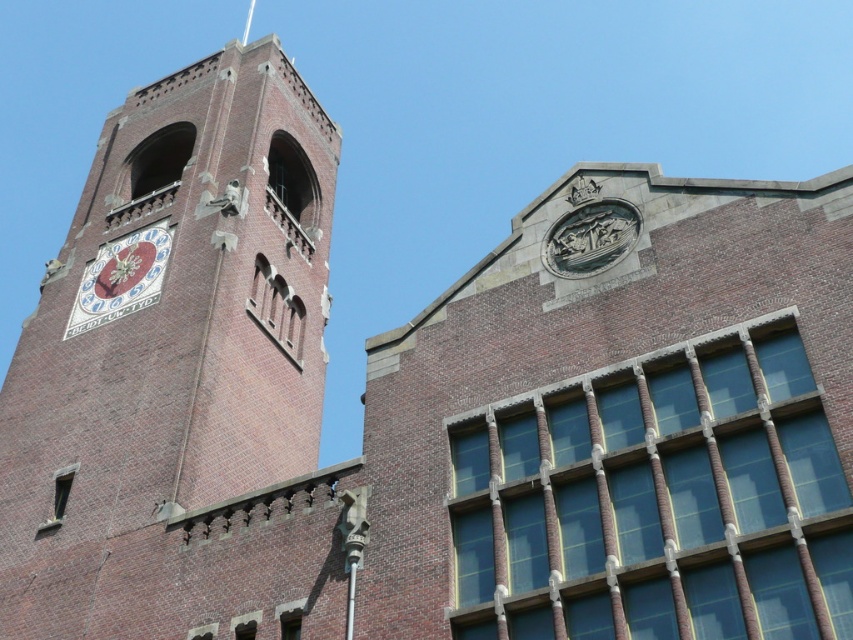
Does point (311, 404) come behind point (86, 264)?

That is False.

Between brick clock tower at left and matte white clock at upper left, which one has more height?

With more height is brick clock tower at left.

Find the location of a particular element. Image resolution: width=853 pixels, height=640 pixels. brick clock tower at left is located at coordinates (173, 358).

Find the location of a particular element. The height and width of the screenshot is (640, 853). brick clock tower at left is located at coordinates (173, 358).